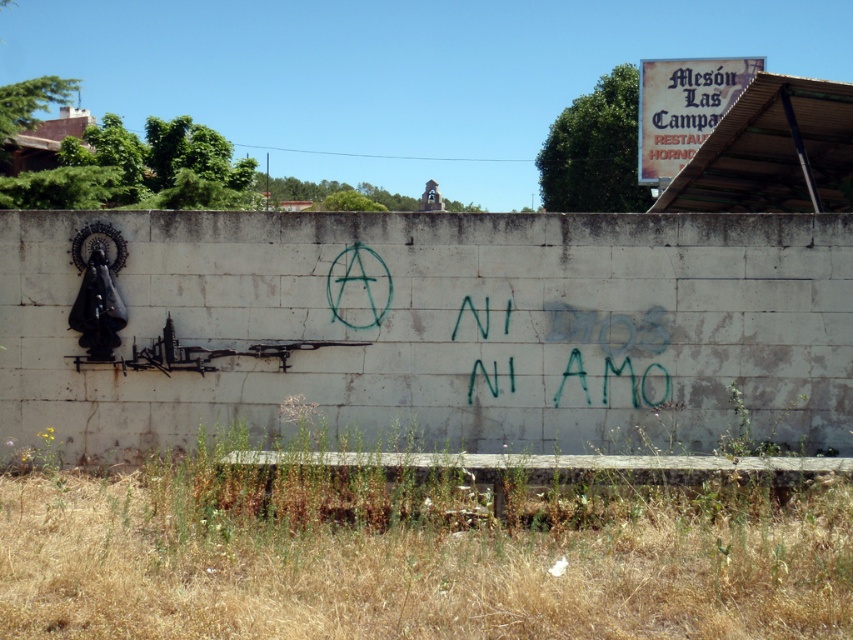
You are standing in front of a wall with several markings. You need to locate the white concrete wall at center. Where is it positioned in terms of coordinates?

The white concrete wall at center is positioned at coordinates [437,330].

Looking at this image, you are an artist planning to paint a mural on the white concrete wall at center and the green paint at center. You need to know which surface has a wider area to accommodate larger designs. Based on the scene description, which object has a greater width?

The white concrete wall at center has a greater width than the green paint at center, as stated in the Objects Description that the white concrete wall at center surpasses the green paint at center in width.

You are standing in front of a wall with a black religious figure on the left and a green anarchist symbol on the right. There is a point marked at coordinates (437, 330). What does this point represent?

The point at coordinates (437, 330) represents the white concrete wall at center.